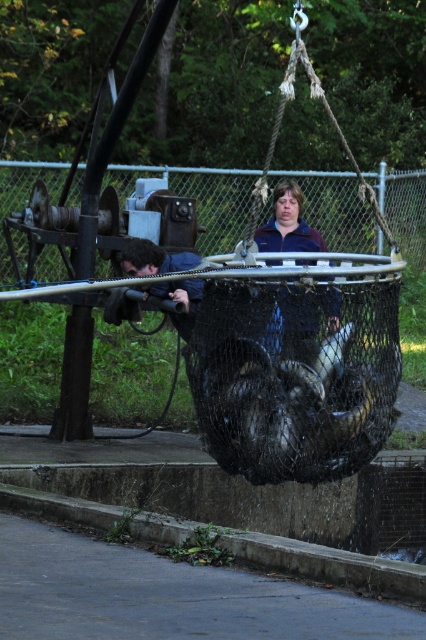
You are a safety inspector standing at the concrete at lower left. You need to reach the blue fabric jacket at center to check for compliance. Can you safely walk directly to the jacket without stepping over any obstacles, given that your required path is clear and you can move freely?

The distance between the concrete at lower left and blue fabric jacket at center is 1.76 meters. Since there are no mentioned obstacles in the scene description, you can safely walk directly to the jacket.